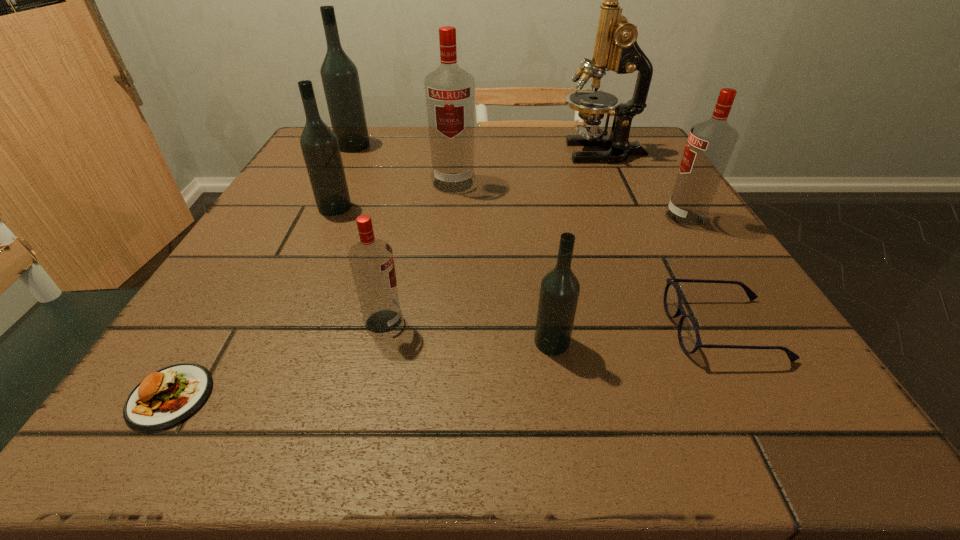
In the image, there is a desktop. In order to click on vacant space at the near edge in this screenshot , I will do `click(331, 398)`.

At what (x,y) coordinates should I click in order to perform the action: click on vacant position at the left edge of the desktop. Please return your answer as a coordinate pair (x, y). Image resolution: width=960 pixels, height=540 pixels. Looking at the image, I should click on (323, 253).

The width and height of the screenshot is (960, 540). Identify the location of vacant area at the right edge of the desktop. (743, 296).

This screenshot has width=960, height=540. In the image, there is a desktop. Find the location of `vacant space at the far left corner`. vacant space at the far left corner is located at coordinates (372, 127).

Find the location of a particular element. The height and width of the screenshot is (540, 960). free space between the gray microscope and the farthest vodka is located at coordinates (478, 149).

In order to click on vacant space that is in between the seventh nearest object and the leftmost red vodka in this screenshot , I will do `click(419, 253)`.

Where is `vacant point located between the fifth object from left to right and the rightmost red vodka`? vacant point located between the fifth object from left to right and the rightmost red vodka is located at coordinates (569, 200).

You are a GUI agent. You are given a task and a screenshot of the screen. Output one action in this format:
    pyautogui.click(x=<x>, y=<y>)
    Task: Click on the free space that is in between the shortest object and the second red vodka from left to right
    This screenshot has width=960, height=540.
    Given the screenshot: What is the action you would take?
    pyautogui.click(x=312, y=289)

Find the location of a particular element. vacant space that's between the rightmost vodka and the rightmost black vodka is located at coordinates (618, 280).

I want to click on blank region between the farthest black vodka and the rightmost red vodka, so click(519, 182).